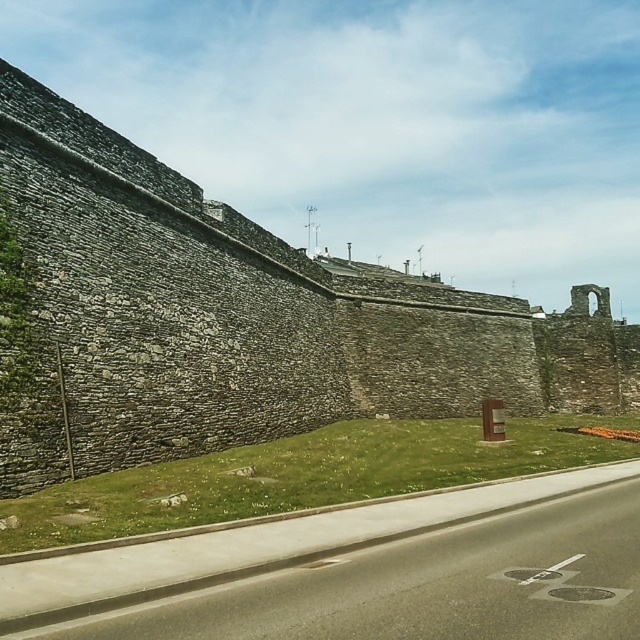
You are standing in a park and see the gray stone wall at center and the green grass at lower center. Which object is located to the right of the other?

The gray stone wall at center is to the right of the green grass at lower center.

You are standing at the base of the historical stone wall and want to walk to the asphalt road at lower center. According to the scene, which direction should you head relative to the green grass at lower center?

The asphalt road at lower center is located above the green grass at lower center, so you should head upwards towards the asphalt road at lower center.